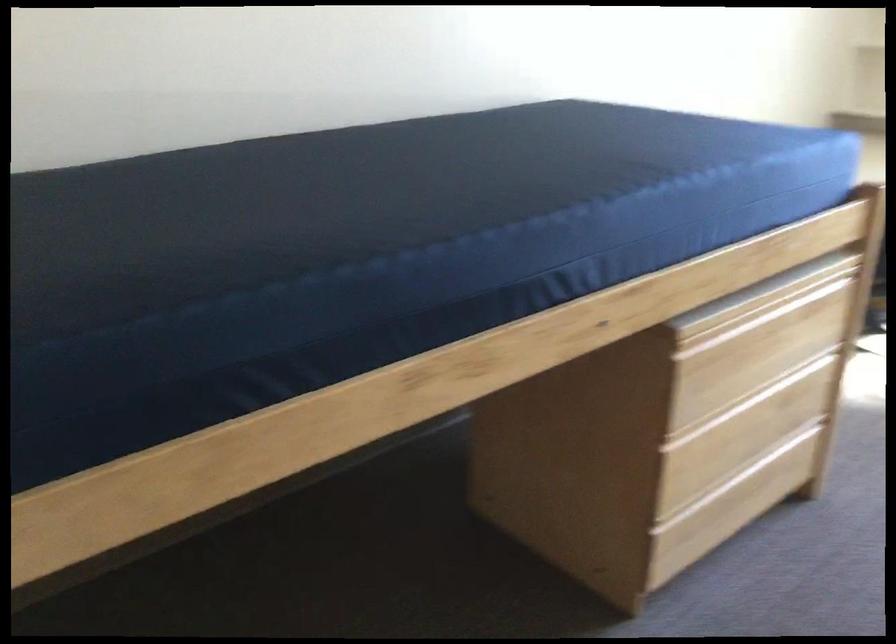
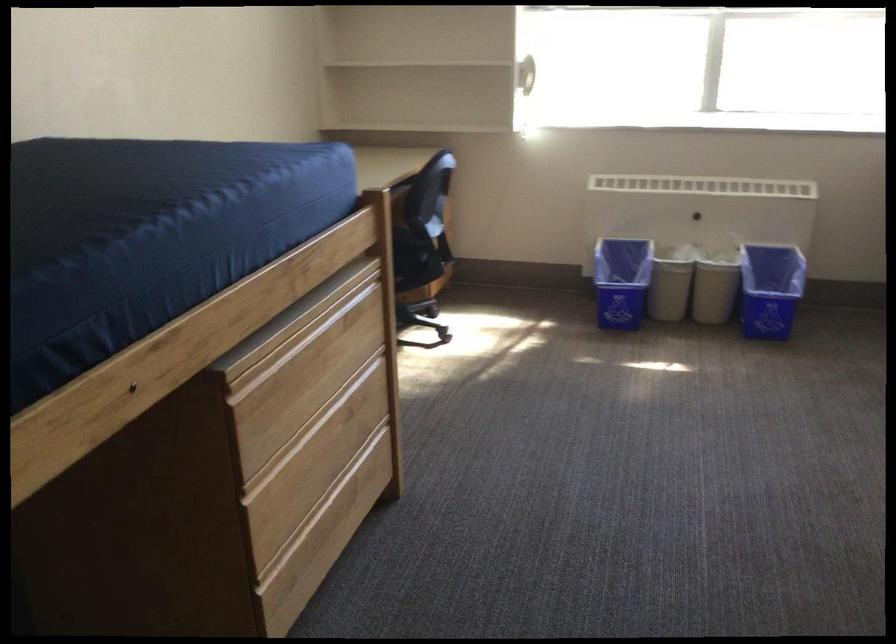
Question: The first image is from the beginning of the video and the second image is from the end. How did the camera likely rotate when shooting the video?

Choices:
 (A) Left
 (B) Right
 (C) Up
 (D) Down

Answer: (B)